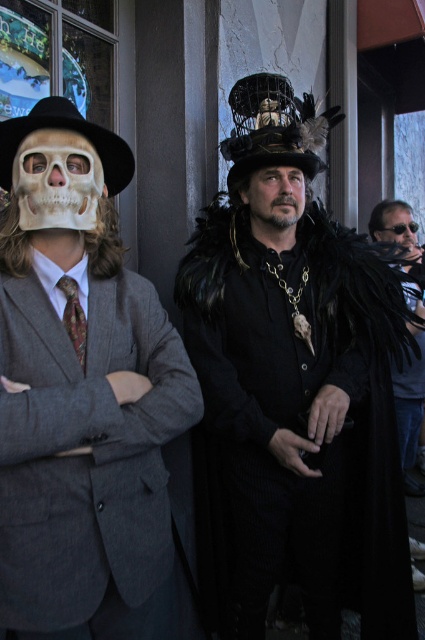
Can you confirm if black velvet cape at right is positioned above matte black sunglasses at upper right?

No.

Does black velvet cape at right appear on the right side of matte black sunglasses at upper right?

Yes, black velvet cape at right is to the right of matte black sunglasses at upper right.

Who is more distant from viewer, (410, 248) or (407, 214)?

Positioned behind is point (407, 214).

The width and height of the screenshot is (425, 640). Identify the location of black velvet cape at right. click(410, 412).

Which is behind, point (19, 180) or point (11, 134)?

Point (19, 180)

Is point (50, 212) positioned before point (125, 163)?

That is True.

The width and height of the screenshot is (425, 640). What do you see at coordinates (56, 180) in the screenshot? I see `white matte skull mask at left` at bounding box center [56, 180].

The height and width of the screenshot is (640, 425). Identify the location of white matte skull mask at left. (56, 180).

Looking at this image, does shiny black feathered hat at center have a smaller size compared to white matte skull mask at left?

No.

Does point (323, 433) come farther from viewer compared to point (73, 193)?

Yes, it is behind point (73, 193).

You are a GUI agent. You are given a task and a screenshot of the screen. Output one action in this format:
    pyautogui.click(x=<x>, y=<y>)
    Task: Click on the shiny black feathered hat at center
    
    Given the screenshot: What is the action you would take?
    pyautogui.click(x=297, y=387)